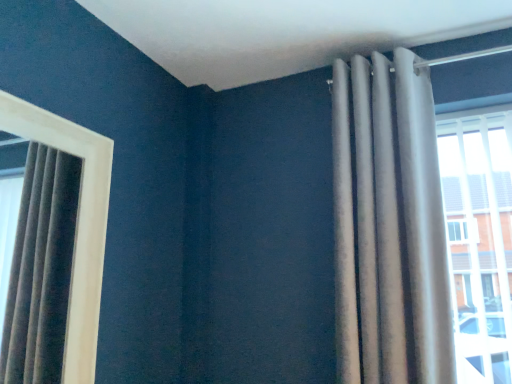
Image resolution: width=512 pixels, height=384 pixels. What do you see at coordinates (389, 225) in the screenshot?
I see `satin grey curtain at upper right` at bounding box center [389, 225].

Where is `satin grey curtain at upper right`? satin grey curtain at upper right is located at coordinates (389, 225).

At what (x,y) coordinates should I click in order to perform the action: click on satin grey curtain at upper right. Please return your answer as a coordinate pair (x, y). This screenshot has height=384, width=512. Looking at the image, I should click on (389, 225).